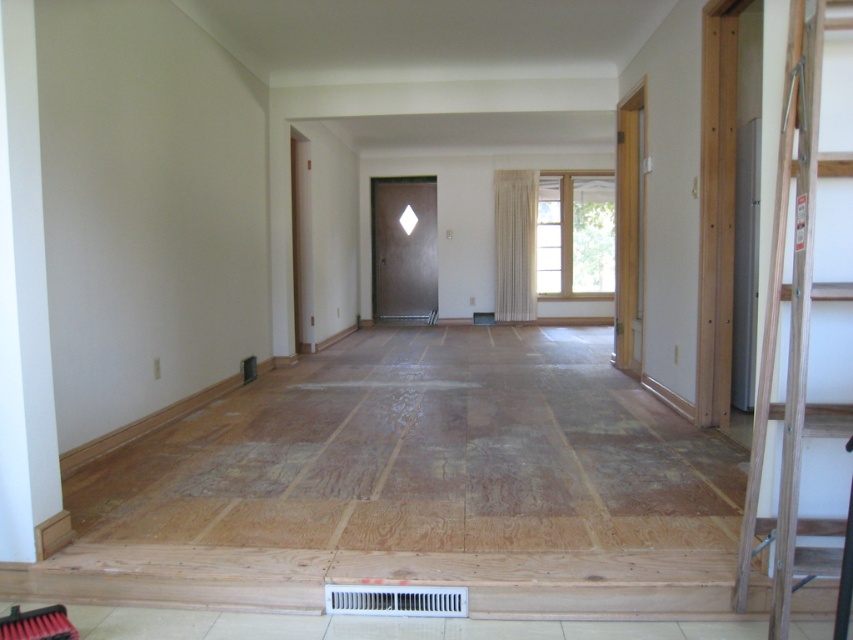
Between wooden ladder at right and white plastic air conditioner at lower center, which one appears on the right side from the viewer's perspective?

Positioned to the right is wooden ladder at right.

Image resolution: width=853 pixels, height=640 pixels. What are the coordinates of `wooden ladder at right` in the screenshot? It's located at (790, 330).

The width and height of the screenshot is (853, 640). Find the location of `wooden ladder at right`. wooden ladder at right is located at coordinates (790, 330).

Does matte dark brown door at center appear on the left side of white plastic air conditioner at lower center?

Indeed, matte dark brown door at center is positioned on the left side of white plastic air conditioner at lower center.

Is point (402, 321) more distant than point (355, 608)?

Yes.

Which is behind, point (397, 212) or point (335, 611)?

Positioned behind is point (397, 212).

Identify the location of matte dark brown door at center. The height and width of the screenshot is (640, 853). (403, 248).

Who is positioned more to the right, wooden ladder at right or matte dark brown door at center?

wooden ladder at right is more to the right.

At what (x,y) coordinates should I click in order to perform the action: click on wooden ladder at right. Please return your answer as a coordinate pair (x, y). This screenshot has height=640, width=853. Looking at the image, I should click on (790, 330).

What do you see at coordinates (790, 330) in the screenshot?
I see `wooden ladder at right` at bounding box center [790, 330].

The height and width of the screenshot is (640, 853). Identify the location of wooden ladder at right. (790, 330).